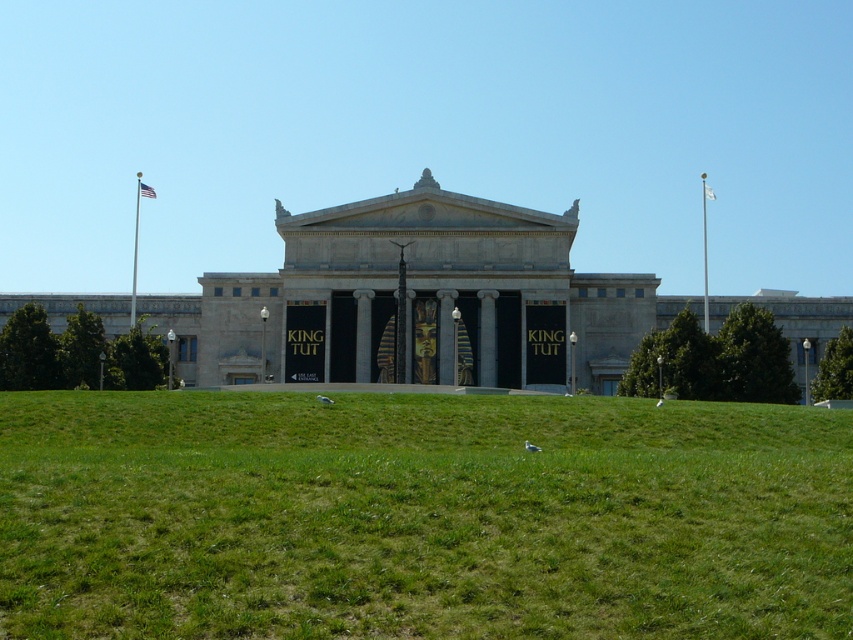
Based on the photo, you are a visitor standing in front of the classical building with the King Tut exhibition. You see the green grass at lower center and the metallic flag pole at left. Which object is nearer to you?

The green grass at lower center is closer to the viewer than the metallic flag pole at left.

You are standing in front of the classical building with the metallic flag pole at left. The building has a large triangular pediment and two doors labeled

The metallic flag pole at left is 440.95 feet away from the viewer.